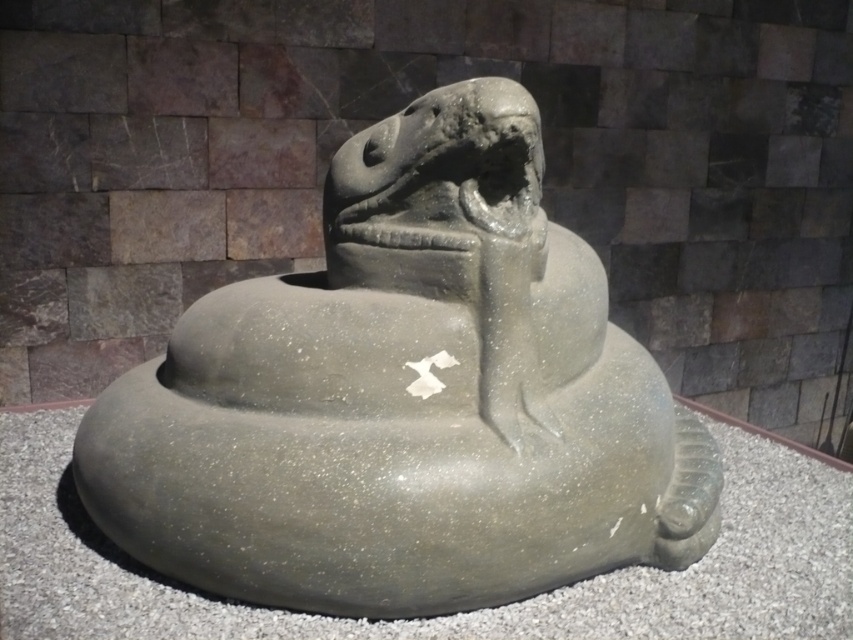
Does point (219, 372) lie behind point (769, 513)?

No, (219, 372) is in front of (769, 513).

Measure the distance from gray stone sculpture at center to gray speckled stone snake at center.

The distance of gray stone sculpture at center from gray speckled stone snake at center is 17.94 inches.

Who is more distant from viewer, (x=198, y=369) or (x=207, y=632)?

The point (x=198, y=369) is behind.

This screenshot has width=853, height=640. In order to click on gray stone sculpture at center in this screenshot , I will do `click(405, 397)`.